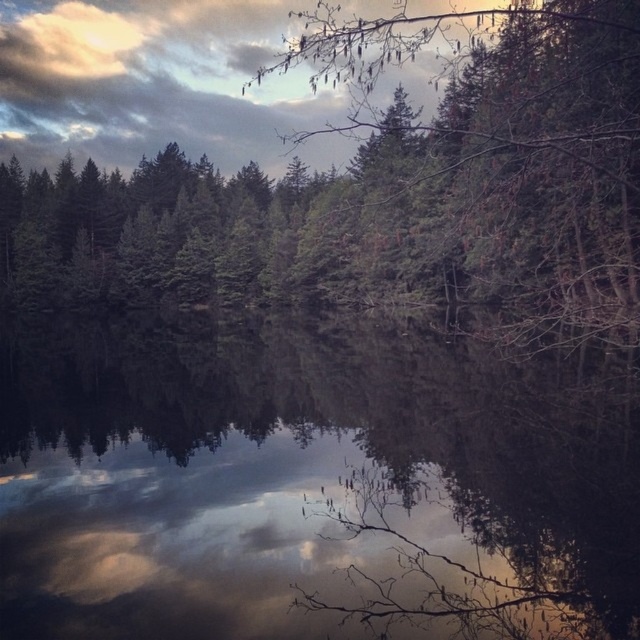
Measure the distance between glossy reflective water at center and camera.

8.69 meters

What do you see at coordinates (305, 486) in the screenshot?
I see `glossy reflective water at center` at bounding box center [305, 486].

Is point (568, 465) positioned behind point (32, 262)?

No, it is in front of (32, 262).

Where is `glossy reflective water at center`? glossy reflective water at center is located at coordinates (305, 486).